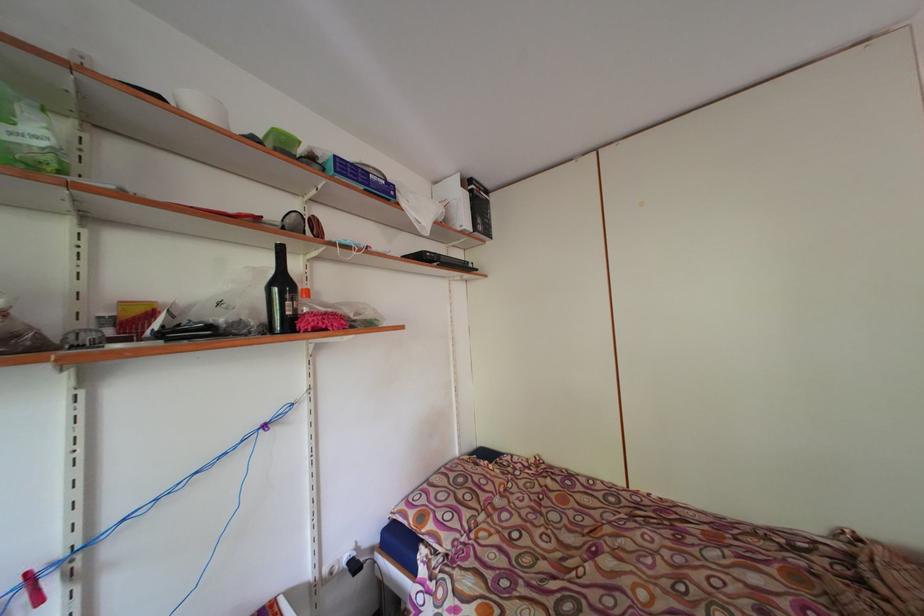
Find where to lift the white ceramic bowl. Please return your answer as a coordinate pair (x, y).

(201, 106)